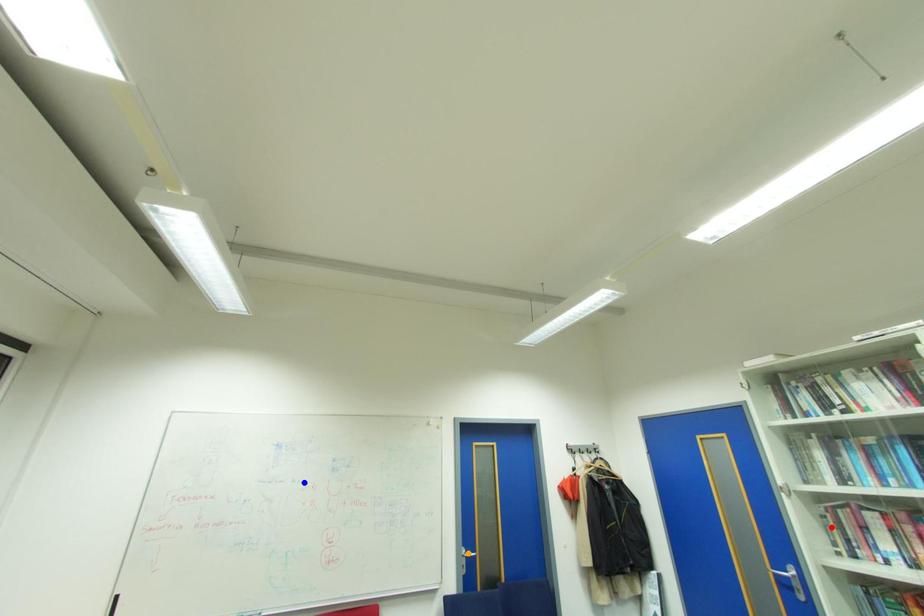
Order these from nearest to farthest:
blue point, red point, orange point

red point < blue point < orange point